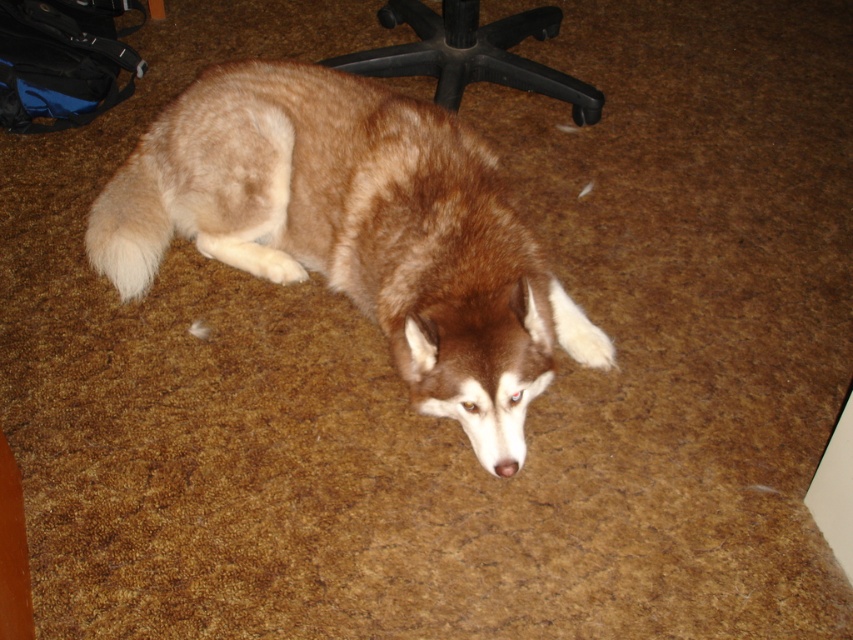
Question: Which of the following is the closest to the observer?

Choices:
 (A) black plastic swivel chair at upper center
 (B) brown fur dog at center

Answer: (B)

Question: Is the position of brown fur dog at center less distant than that of black plastic swivel chair at upper center?

Choices:
 (A) yes
 (B) no

Answer: (A)

Question: Does brown fur dog at center appear under black plastic swivel chair at upper center?

Choices:
 (A) yes
 (B) no

Answer: (A)

Question: Which point is closer to the camera?

Choices:
 (A) black plastic swivel chair at upper center
 (B) brown fur dog at center

Answer: (B)

Question: Does brown fur dog at center appear under black plastic swivel chair at upper center?

Choices:
 (A) yes
 (B) no

Answer: (A)

Question: Which point appears closest to the camera in this image?

Choices:
 (A) (460, 61)
 (B) (425, 401)

Answer: (B)